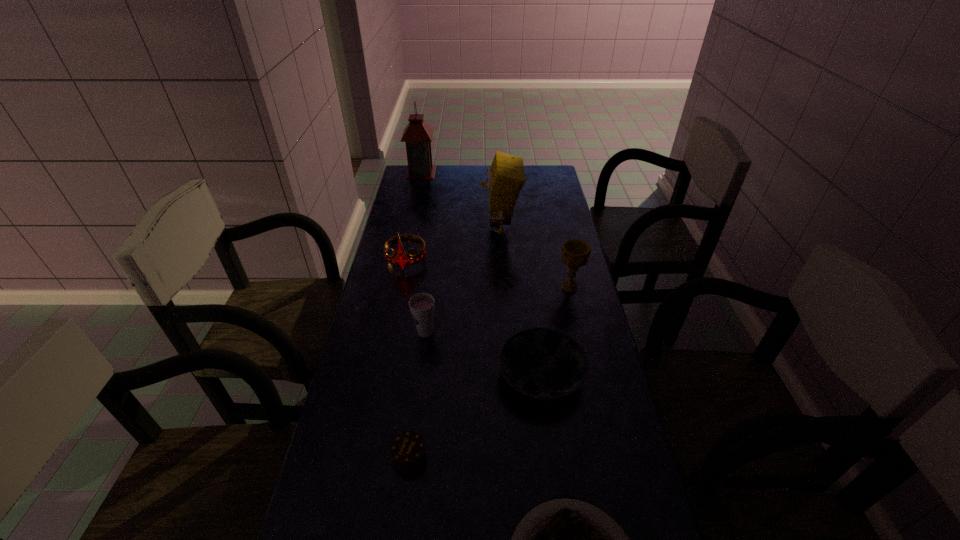
Locate an element on the screen. cup that is positioned at the left edge is located at coordinates (422, 306).

Locate an element on the screen. The height and width of the screenshot is (540, 960). chocolate cake located at the left edge is located at coordinates (408, 450).

Find the location of a particular element. The image size is (960, 540). chalice that is at the right edge is located at coordinates (575, 253).

Identify the location of plate that is at the right edge. The width and height of the screenshot is (960, 540). (541, 363).

Find the location of a particular element. object at the far left corner is located at coordinates (418, 134).

Where is `blank space at the left edge`? The image size is (960, 540). blank space at the left edge is located at coordinates (352, 421).

The width and height of the screenshot is (960, 540). In the image, there is a desktop. Identify the location of vacant space at the right edge. (563, 214).

At what (x,y) coordinates should I click in order to perform the action: click on vacant area at the far left corner of the desktop. Please return your answer as a coordinate pair (x, y). Looking at the image, I should click on (403, 172).

In the image, there is a desktop. In order to click on vacant space at the far right corner in this screenshot , I will do `click(546, 175)`.

Where is `free space between the second farthest object and the chocolate cake`? This screenshot has width=960, height=540. free space between the second farthest object and the chocolate cake is located at coordinates (455, 342).